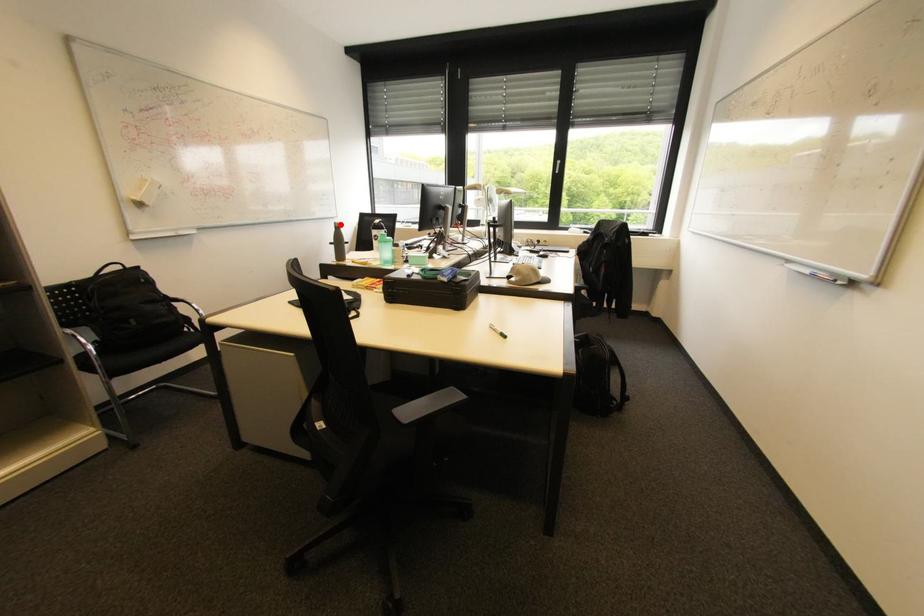
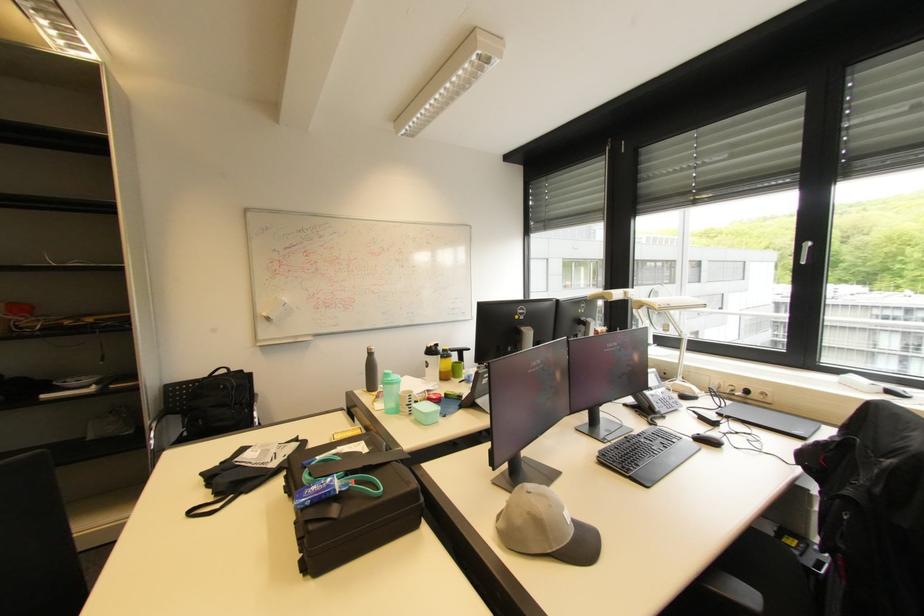
Question: I am providing you with two images of the same scene from different viewpoints. In image1, a red point is highlighted. Considering the same 3D point in image2, which of the following is correct?

Choices:
 (A) It is closer
 (B) It is farther

Answer: (B)